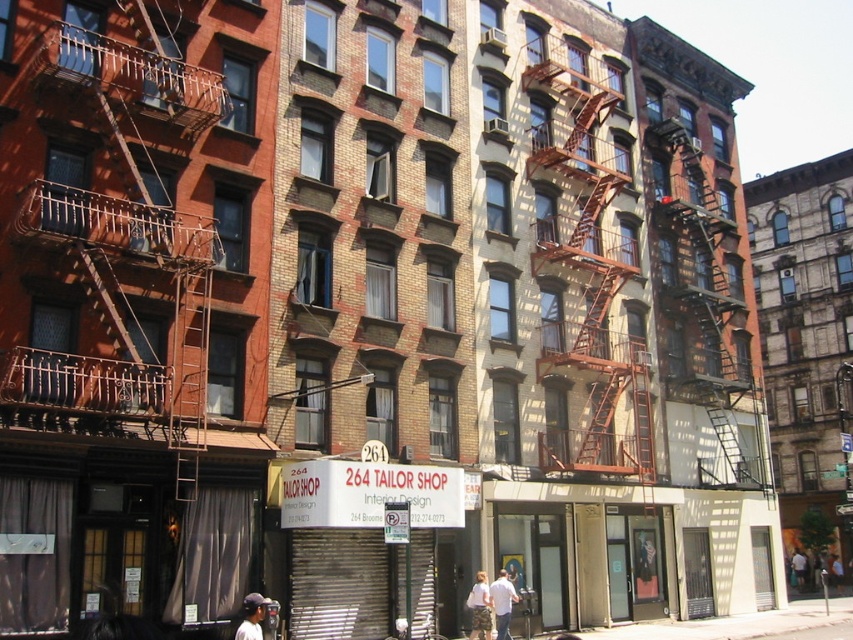
Question: Can you confirm if matte black baseball cap at lower left is thinner than light brown leather jacket at lower right?

Choices:
 (A) yes
 (B) no

Answer: (B)

Question: Is light brown textured shorts at lower center bigger than light brown leather jacket at lower right?

Choices:
 (A) no
 (B) yes

Answer: (B)

Question: Which of the following is the closest to the observer?

Choices:
 (A) (503, 616)
 (B) (251, 634)
 (C) (573, 429)

Answer: (B)

Question: Is white cotton shirt at lower center thinner than dark blue jeans at center?

Choices:
 (A) no
 (B) yes

Answer: (A)

Question: Which point is closer to the camera?

Choices:
 (A) (602, 236)
 (B) (263, 604)

Answer: (B)

Question: Which point appears closest to the camera in this image?

Choices:
 (A) (796, 563)
 (B) (837, 586)

Answer: (A)